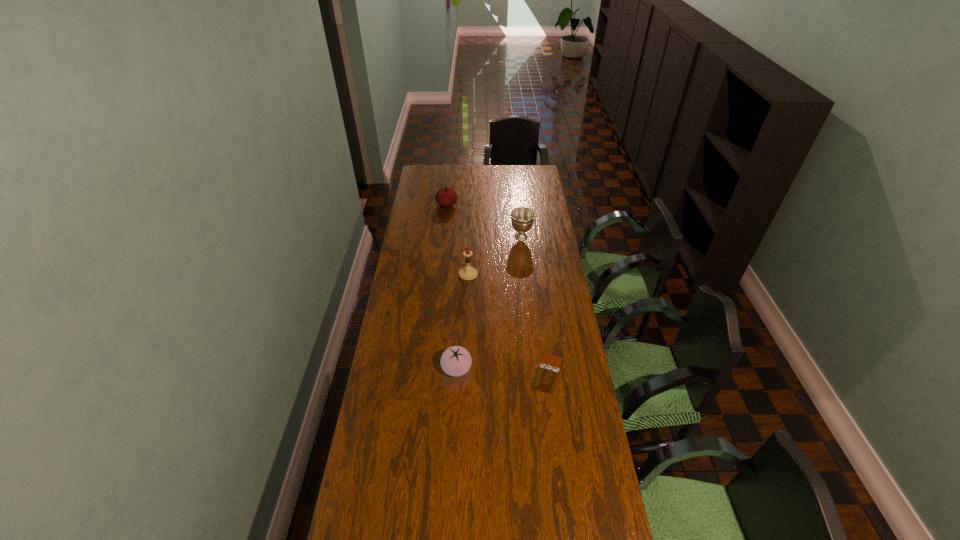
Where is `empty space between the candle and the fourth shortest object`? empty space between the candle and the fourth shortest object is located at coordinates (494, 255).

Identify the location of vacant region between the shortest object and the farther tomato. The width and height of the screenshot is (960, 540). (497, 289).

Where is `free space that is in between the candle and the nearer tomato`? free space that is in between the candle and the nearer tomato is located at coordinates (463, 321).

This screenshot has width=960, height=540. Find the location of `blank region between the nearer tomato and the candle`. blank region between the nearer tomato and the candle is located at coordinates (463, 321).

This screenshot has height=540, width=960. Find the location of `empty space that is in between the third farthest object and the chalice`. empty space that is in between the third farthest object and the chalice is located at coordinates (494, 255).

Find the location of `free space between the candle and the fourth nearest object`. free space between the candle and the fourth nearest object is located at coordinates (494, 255).

Locate an element on the screen. The image size is (960, 540). object that is the third closest to the nearer tomato is located at coordinates (522, 218).

Select which object appears as the second closest to the farthest object. Please provide its 2D coordinates. Your answer should be formatted as a tuple, i.e. [(x, y)], where the tuple contains the x and y coordinates of a point satisfying the conditions above.

[(466, 273)]

This screenshot has height=540, width=960. Identify the location of vacant space that satisfies the following two spatial constraints: 1. on the back side of the candle; 2. on the left side of the chalice. (469, 237).

What are the coordinates of `free space that satisfies the following two spatial constraints: 1. on the back side of the chalice; 2. on the right side of the nearer tomato` in the screenshot? It's located at (463, 237).